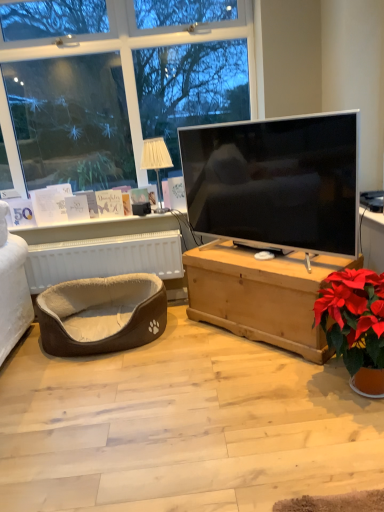
The height and width of the screenshot is (512, 384). Find the location of `free space between brown plush pet bed at lower left and white fabric pet bed at lower left`. free space between brown plush pet bed at lower left and white fabric pet bed at lower left is located at coordinates (167, 328).